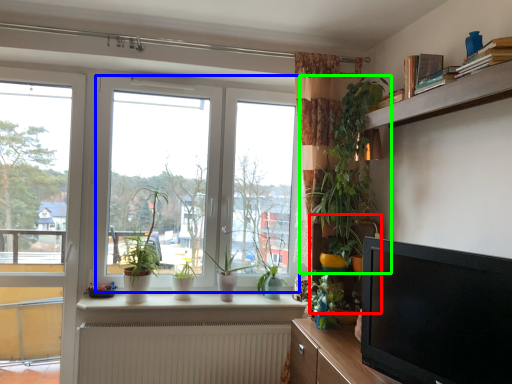
Question: Estimate the real-world distances between objects in this image. Which object is farther from shelf (highlighted by a red box), window (highlighted by a blue box) or houseplant (highlighted by a green box)?

Choices:
 (A) window
 (B) houseplant

Answer: (A)